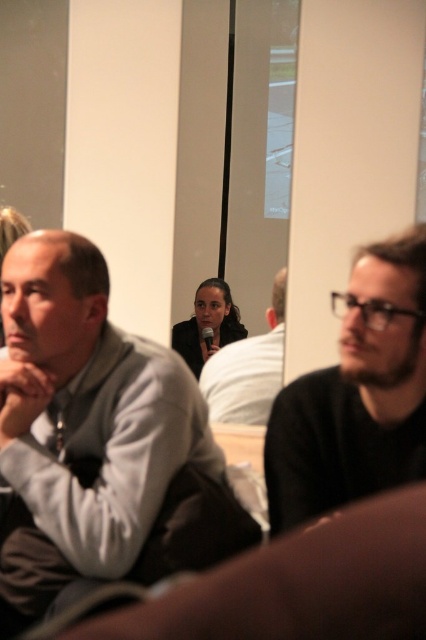
You are attending a meeting and see two people wearing sweaters. The first person is wearing a gray matte sweater at left and the second is wearing a dark gray sweater at center. Which sweater is located more to the left?

The gray matte sweater at left is more to the left than the dark gray sweater at center.

Consider the image. You are organizing a charity event and need to decide which sweater to donate based on size. If the gray matte sweater at left is larger than the dark brown sweater at right, which one should you choose if you want to donate the bigger one?

The gray matte sweater at left is bigger than the dark brown sweater at right, so you should choose the gray matte sweater at left for donation if you want the larger size.

You are attending a virtual meeting and need to focus on the speaker. The dark brown sweater at right and the dark gray sweater at center are both visible on the screen. Which one is closer to you, the viewer?

The dark brown sweater at right is closer to you because it is in front of the dark gray sweater at center.